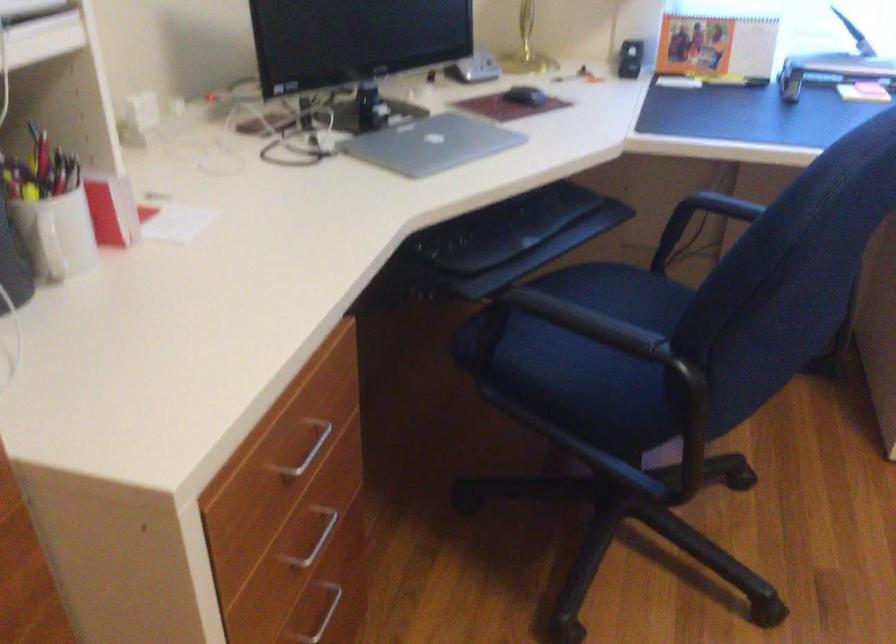
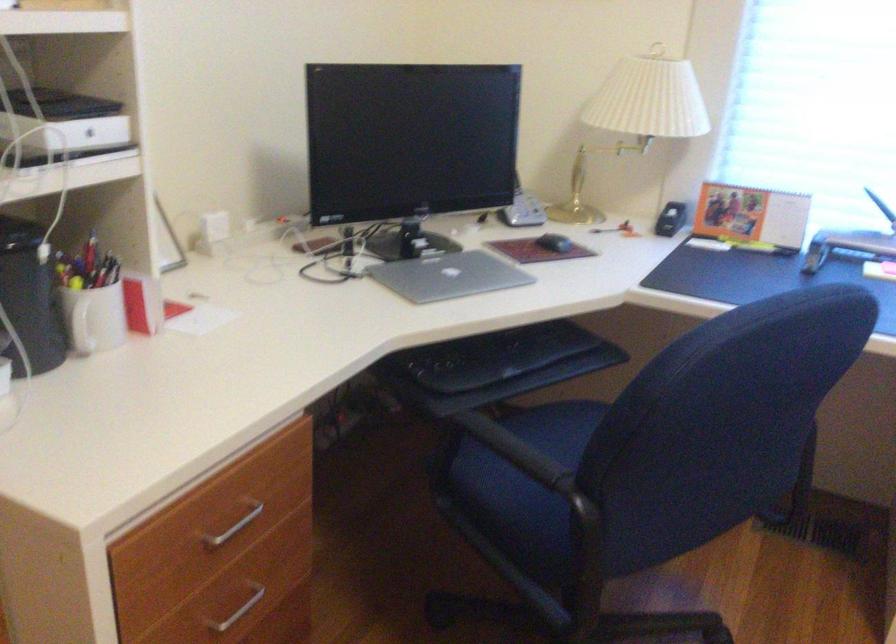
Find the pixel in the second image that matches pixel 311 547 in the first image.

(238, 611)